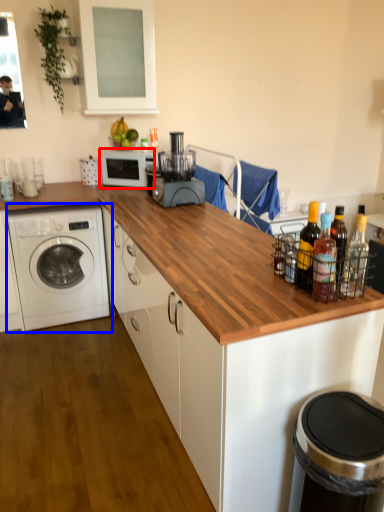
Question: Which point is closer to the camera, home appliance (highlighted by a red box) or washing machine (highlighted by a blue box)?

Choices:
 (A) home appliance
 (B) washing machine

Answer: (B)